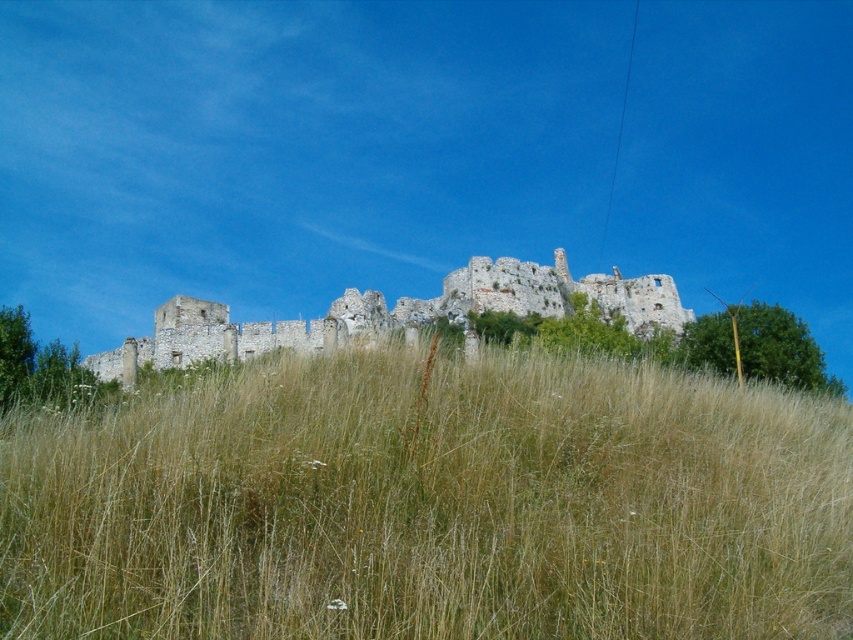
Which is more to the right, brown dry grass at center or weathered stone ruins at center?

Positioned to the right is weathered stone ruins at center.

Does brown dry grass at center appear under weathered stone ruins at center?

Correct, brown dry grass at center is located below weathered stone ruins at center.

What do you see at coordinates (430, 502) in the screenshot?
I see `brown dry grass at center` at bounding box center [430, 502].

I want to click on brown dry grass at center, so (430, 502).